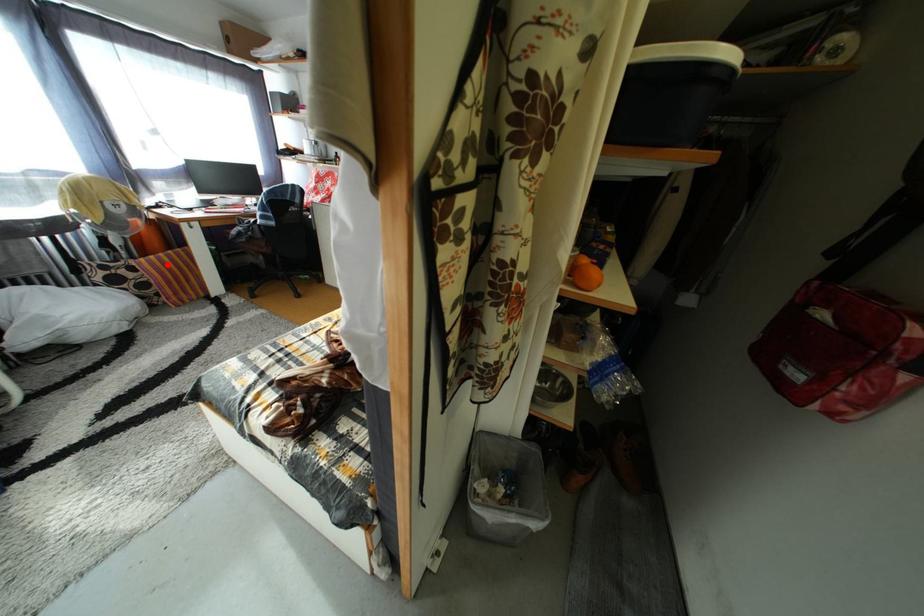
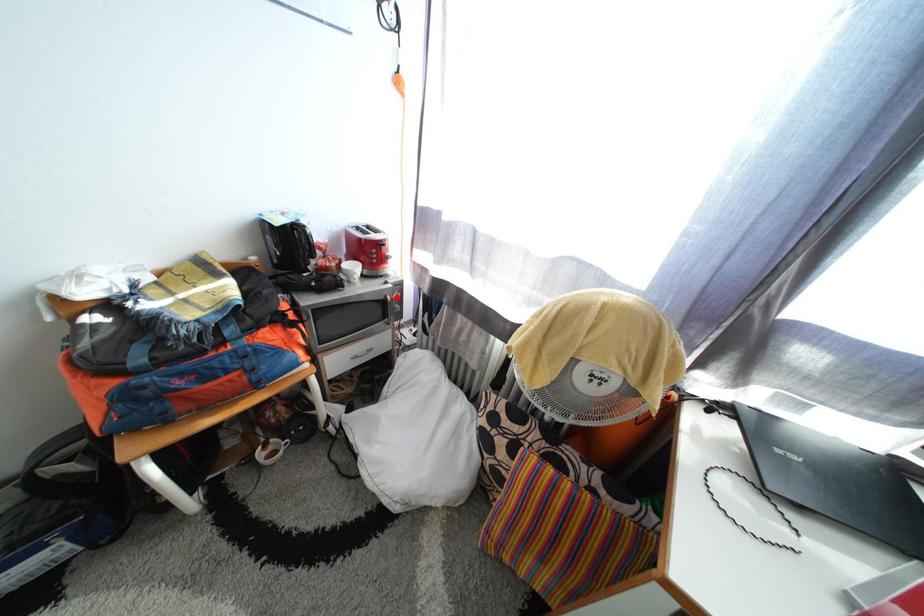
I am providing you with two images of the same scene from different viewpoints. A red point is marked on the first image and another point is marked on the second image. Do the highlighted points in image1 and image2 indicate the same real-world spot?

No